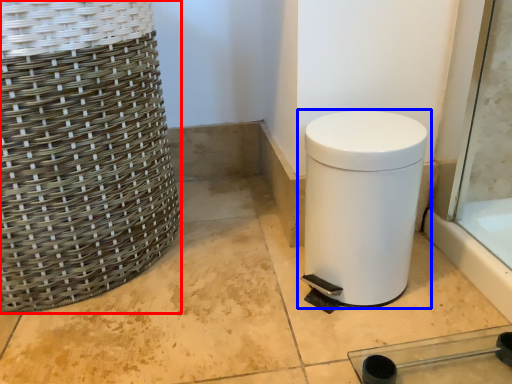
Question: Which object is closer to the camera taking this photo, basket (highlighted by a red box) or waste container (highlighted by a blue box)?

Choices:
 (A) basket
 (B) waste container

Answer: (A)